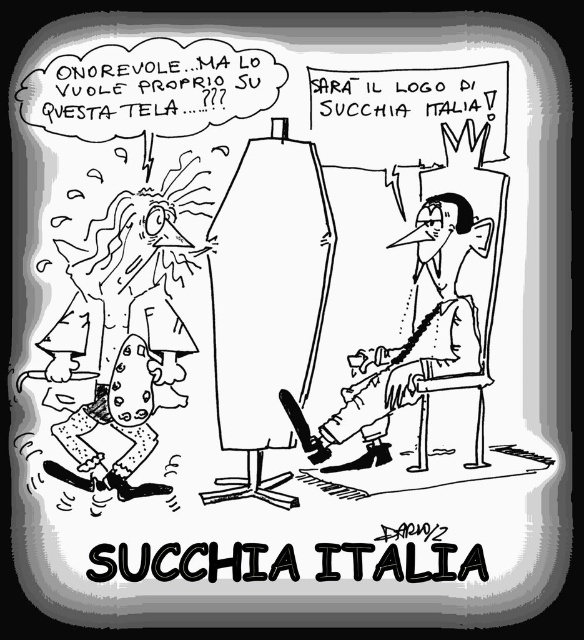
Based on the provided scene description, what is the exact 2D coordinate position of the smooth skin man at center?

The smooth skin man at center is located at the 2D coordinate point of (408, 337).

Consider the image. You are an art critic analyzing this cartoon. You notice the smooth skin man at center and the speckled fabric pants at lower left. Which object occupies more horizontal space in the image?

The smooth skin man at center occupies more horizontal space than the speckled fabric pants at lower left because the smooth skin man at center is wider than the speckled fabric pants at lower left according to the description.